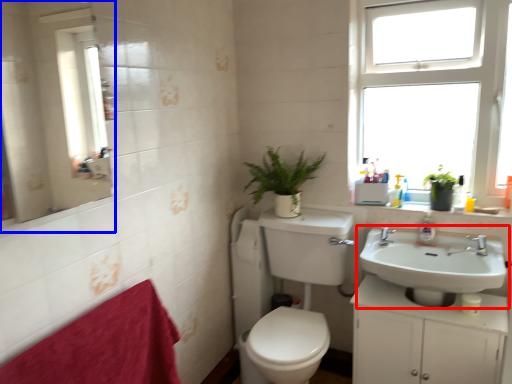
Question: Which of the following is the closest to the observer, sink (highlighted by a red box) or mirror (highlighted by a blue box)?

Choices:
 (A) sink
 (B) mirror

Answer: (B)